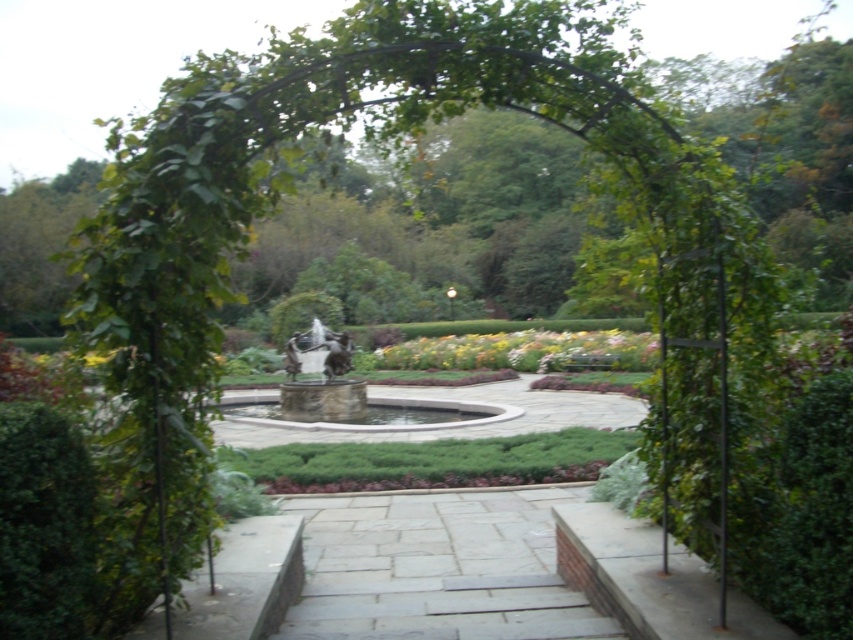
In the garden scene, there is a white marble fountain at center and a polished bronze statue at center. From the perspective of someone standing at the metal archway at the forefront, which object is positioned to the right?

The white marble fountain at center is to the right of the polished bronze statue at center, so from the archway, the white marble fountain at center would be on the right side.

You are standing at the metal archway at the forefront of the garden. You want to walk directly towards the circular fountain at the center. Will you walk over the gray stone path at center marked by point (437, 568)?

Yes, the point (437, 568) marks the gray stone path at center, which leads directly towards the circular fountain at the center of the garden.

You are standing at the metal archway at the front of the garden. You want to walk straight towards the center to reach the white marble fountain at center. Will the yellow matte flowers at center block your path?

The white marble fountain at center is behind the yellow matte flowers at center, so the yellow matte flowers at center will block your path to the fountain.